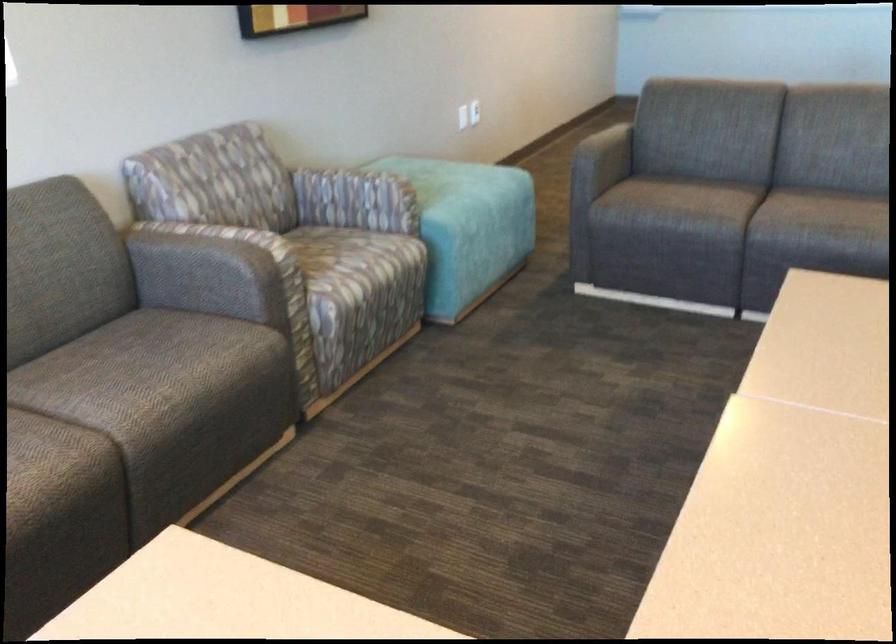
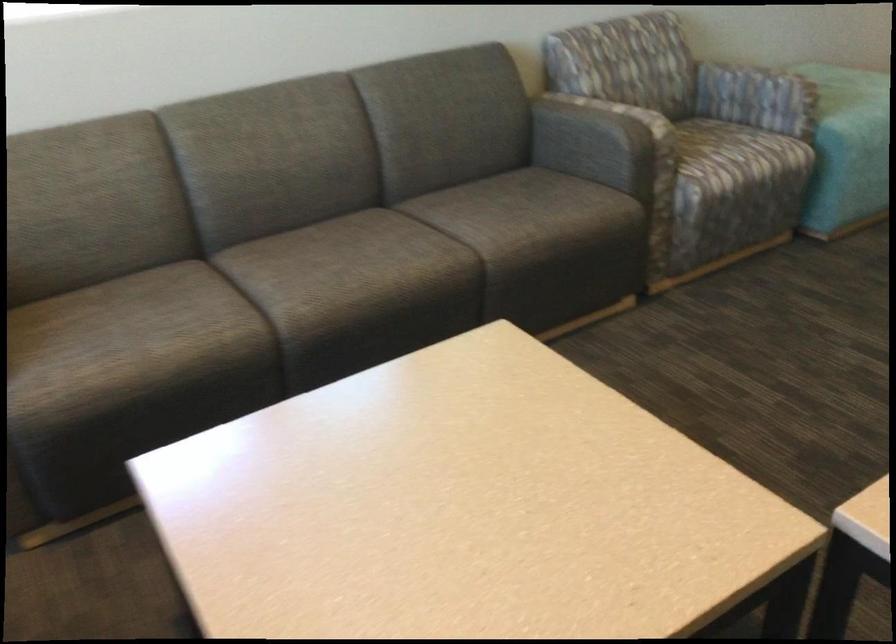
Where in the second image is the point corresponding to the point at 359,265 from the first image?

(737, 155)